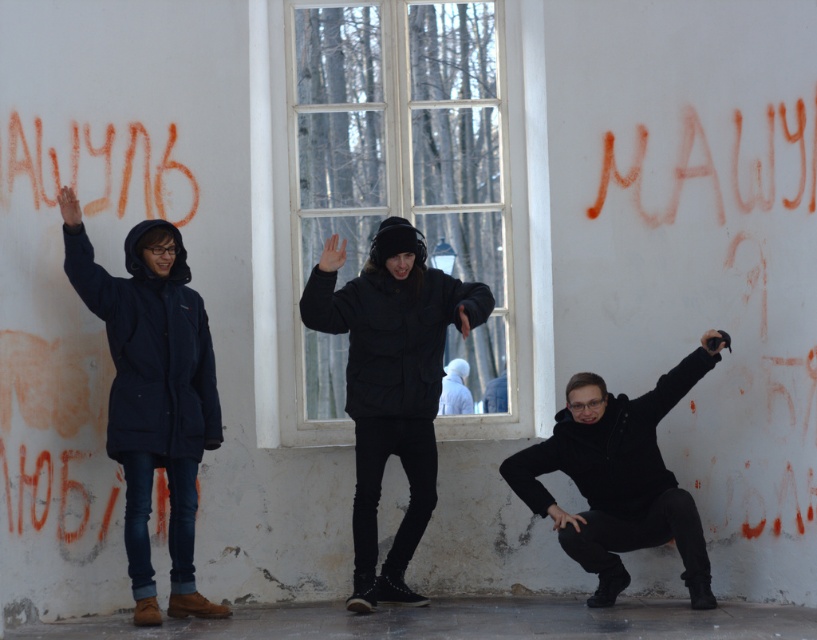
You are standing in an abandoned building with a large window behind three people. The left person is wearing a dark blue hooded jacket, the center person is in a black matte jacket, and the right person is wearing a red sweater. A point at coordinates (391,384) is marked. Which person is this point located on?

The point at coordinates (391,384) is located on the black matte jacket at center.

You are a fashion designer observing two people wearing black matte jackets in an abandoned building. The jackets are labeled as the black matte jacket at center and the black matte jacket at lower right. Which of these jackets appears to be narrower?

The black matte jacket at center has a lesser width compared to the black matte jacket at lower right, so the jacket at center is narrower.